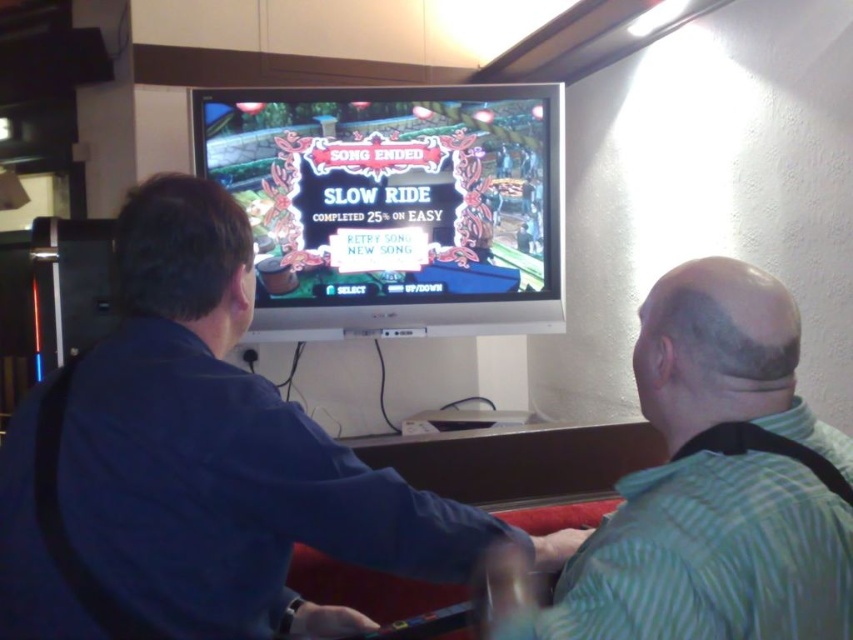
Question: Which point is closer to the camera?

Choices:
 (A) (357, 557)
 (B) (769, 602)

Answer: (B)

Question: Is matte plastic video game at center positioned in front of green striped shirt at right?

Choices:
 (A) yes
 (B) no

Answer: (B)

Question: Is blue shirt at center bigger than matte plastic video game at center?

Choices:
 (A) yes
 (B) no

Answer: (A)

Question: Is blue shirt at center behind green striped shirt at right?

Choices:
 (A) no
 (B) yes

Answer: (B)

Question: Which of these objects is positioned farthest from the matte plastic video game at center?

Choices:
 (A) green striped shirt at right
 (B) blue shirt at center

Answer: (A)

Question: Which point is farther to the camera?

Choices:
 (A) green striped shirt at right
 (B) blue shirt at center

Answer: (B)